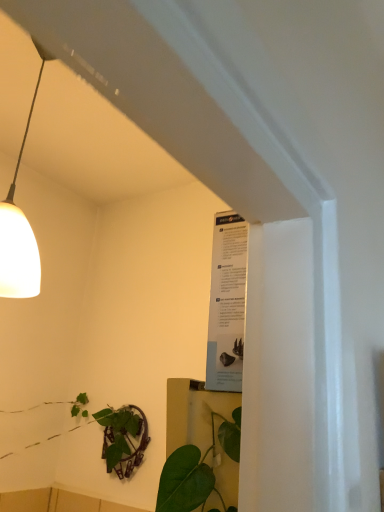
Describe the element at coordinates (227, 303) in the screenshot. I see `white paper poster at upper right` at that location.

What is the approximate height of white paper poster at upper right?

The height of white paper poster at upper right is 11.46 inches.

The width and height of the screenshot is (384, 512). Find the location of `white paper poster at upper right`. white paper poster at upper right is located at coordinates (227, 303).

In order to face white paper poster at upper right, should I rotate leftwards or rightwards?

A 6.425 degree turn to the right will do.

This screenshot has height=512, width=384. I want to click on white paper poster at upper right, so click(227, 303).